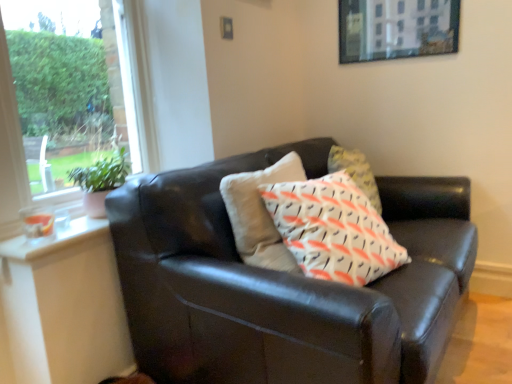
Question: From the image's perspective, relative to clear glass window at upper left, is matte black couch at center above or below?

Choices:
 (A) below
 (B) above

Answer: (A)

Question: In terms of size, does matte black couch at center appear bigger or smaller than clear glass window at upper left?

Choices:
 (A) small
 (B) big

Answer: (B)

Question: Based on their relative distances, which object is nearer to the metallic silver picture frame at upper center?

Choices:
 (A) matte black couch at center
 (B) clear glass window at upper left
 (C) green leafy plant at left

Answer: (A)

Question: Estimate the real-world distances between objects in this image. Which object is farther from the green leafy plant at left?

Choices:
 (A) metallic silver picture frame at upper center
 (B) matte black couch at center
 (C) clear glass window at upper left

Answer: (A)